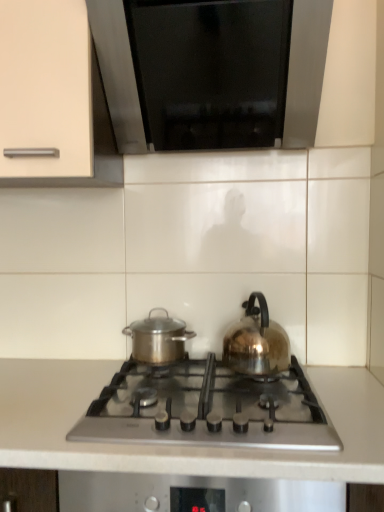
The image size is (384, 512). Identify the location of free space that is in between stainless steel pot at center and translucent glass kettle at right. (198, 368).